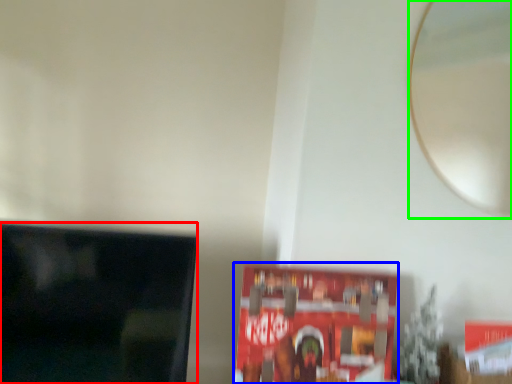
Question: Which object is the farthest from television (highlighted by a red box)? Choose among these: paperback book (highlighted by a blue box) or mirror (highlighted by a green box).

Choices:
 (A) paperback book
 (B) mirror

Answer: (B)